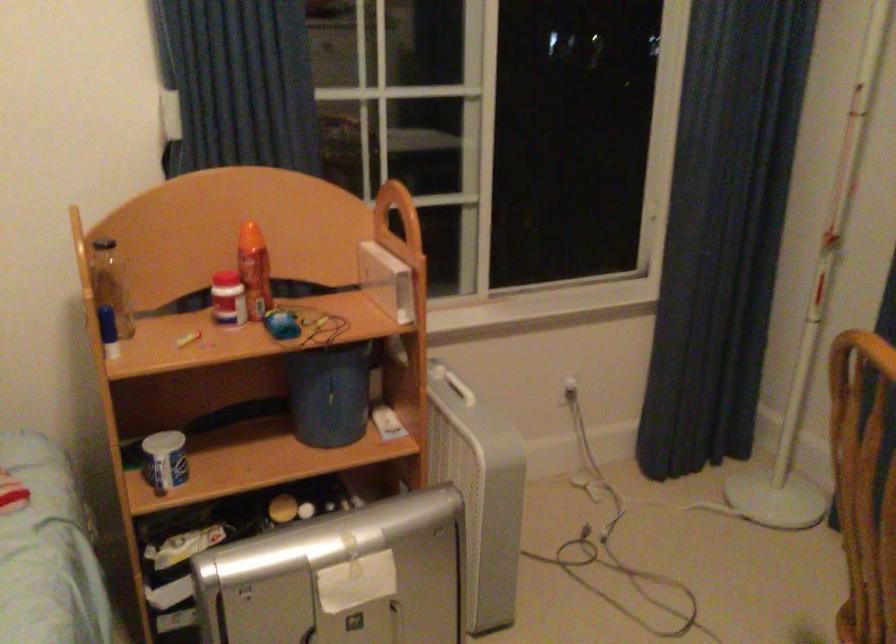
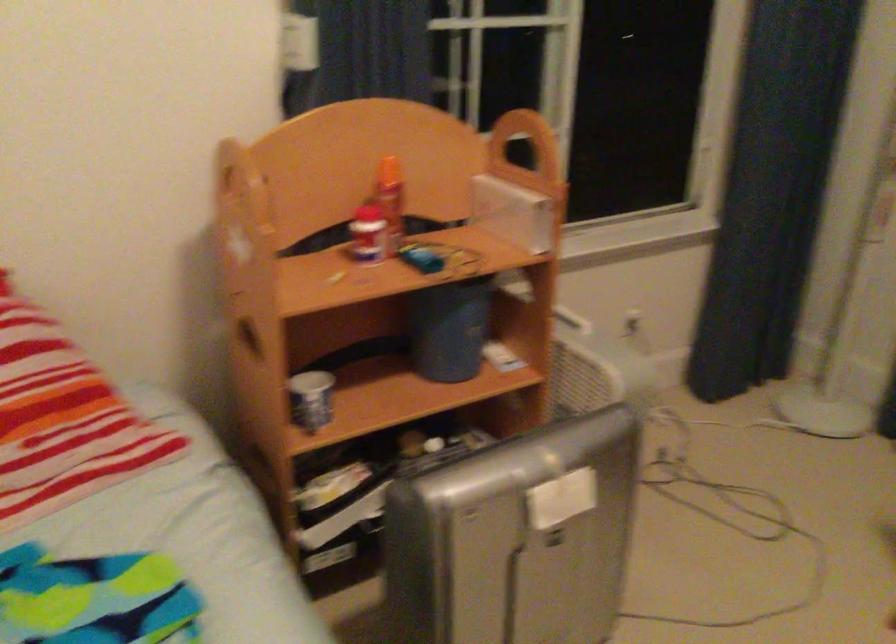
Question: The images are taken continuously from a first-person perspective. In which direction are you moving?

Choices:
 (A) Left
 (B) Right
 (C) Forward
 (D) Backward

Answer: (A)